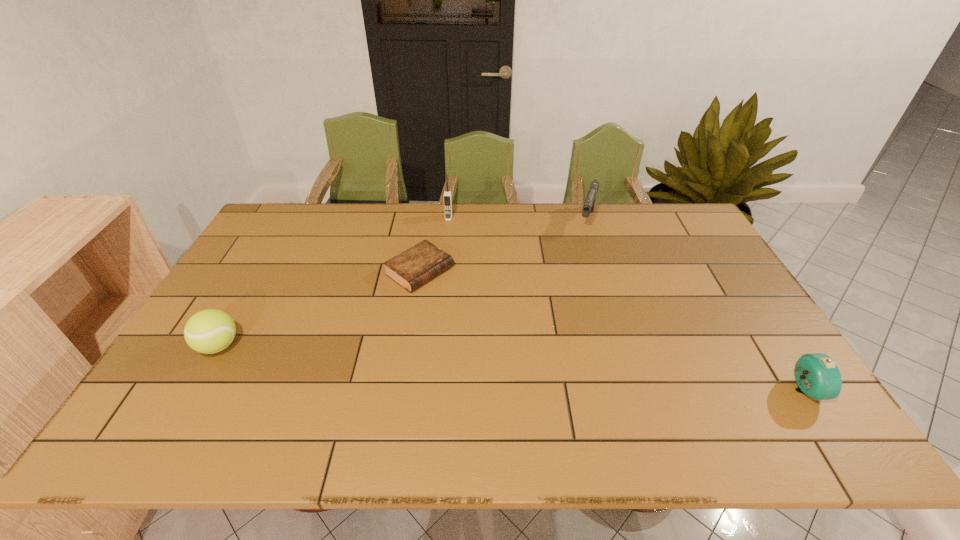
Image resolution: width=960 pixels, height=540 pixels. Find the location of `object that is at the near edge`. object that is at the near edge is located at coordinates (817, 375).

Identify the location of object positioned at the left edge. (209, 331).

At what (x,y) coordinates should I click in order to perform the action: click on object present at the right edge. Please return your answer as a coordinate pair (x, y). The height and width of the screenshot is (540, 960). Looking at the image, I should click on click(x=817, y=375).

I want to click on object located at the near right corner, so click(817, 375).

Image resolution: width=960 pixels, height=540 pixels. Find the location of `free space at the far edge of the desktop`. free space at the far edge of the desktop is located at coordinates (502, 219).

In the image, there is a desktop. Where is `blank space at the near edge`? The height and width of the screenshot is (540, 960). blank space at the near edge is located at coordinates (412, 386).

The width and height of the screenshot is (960, 540). In order to click on vacant space at the left edge of the desktop in this screenshot , I will do `click(283, 244)`.

Locate an element on the screen. vacant space at the right edge of the desktop is located at coordinates (712, 288).

This screenshot has height=540, width=960. I want to click on vacant space at the far left corner of the desktop, so click(284, 232).

In the image, there is a desktop. Where is `free space at the far right corner`? The height and width of the screenshot is (540, 960). free space at the far right corner is located at coordinates (676, 217).